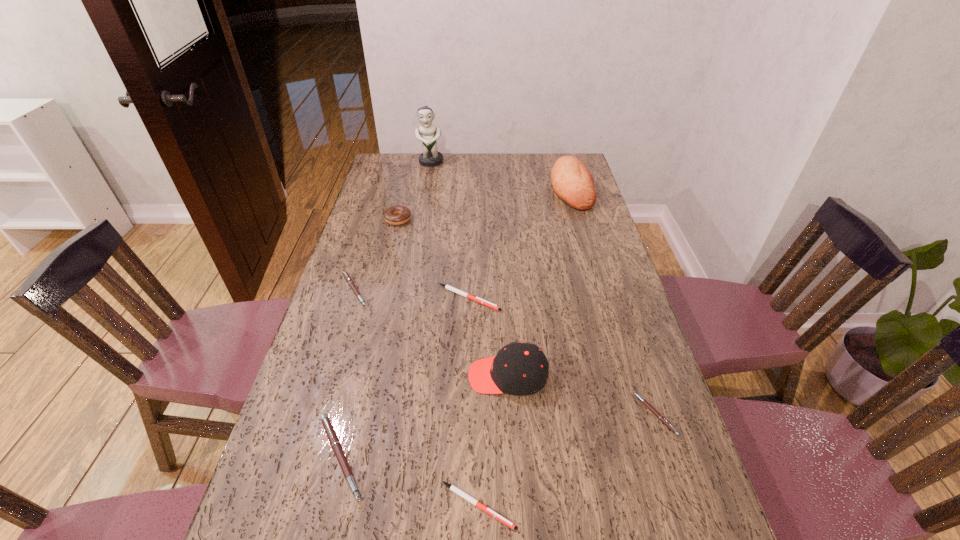
You are a GUI agent. You are given a task and a screenshot of the screen. Output one action in this format:
    pyautogui.click(x=<x>, y=<y>)
    Task: Click on the rightmost pen
    This screenshot has height=540, width=960.
    Given the screenshot: What is the action you would take?
    pyautogui.click(x=651, y=408)

What are the coordinates of `the rightmost pink pen` in the screenshot? It's located at (651, 408).

The height and width of the screenshot is (540, 960). I want to click on the nearer white pen, so click(x=456, y=490).

The width and height of the screenshot is (960, 540). I want to click on free space located 0.070m on the front-facing side of the green figurine, so click(x=428, y=177).

You are a GUI agent. You are given a task and a screenshot of the screen. Output one action in this format:
    pyautogui.click(x=<x>, y=<y>)
    Task: Click on the blank area located on the left of the bread
    The height and width of the screenshot is (540, 960).
    Given the screenshot: What is the action you would take?
    pyautogui.click(x=480, y=188)

At what (x,y) coordinates should I click in order to perform the action: click on free space located on the front-facing side of the cap. Please return your answer as a coordinate pair (x, y). Looking at the image, I should click on (421, 376).

Find the location of a particular element. The width and height of the screenshot is (960, 540). vacant space located 0.320m on the front-facing side of the cap is located at coordinates (342, 376).

I want to click on blank area located on the front-facing side of the cap, so click(323, 376).

At what (x,y) coordinates should I click in order to perform the action: click on blank area located on the back of the doughnut. Please return your answer as a coordinate pair (x, y). The height and width of the screenshot is (540, 960). Looking at the image, I should click on (407, 181).

The width and height of the screenshot is (960, 540). I want to click on free region located 0.400m at the nib of the biggest pink pen, so click(x=554, y=457).